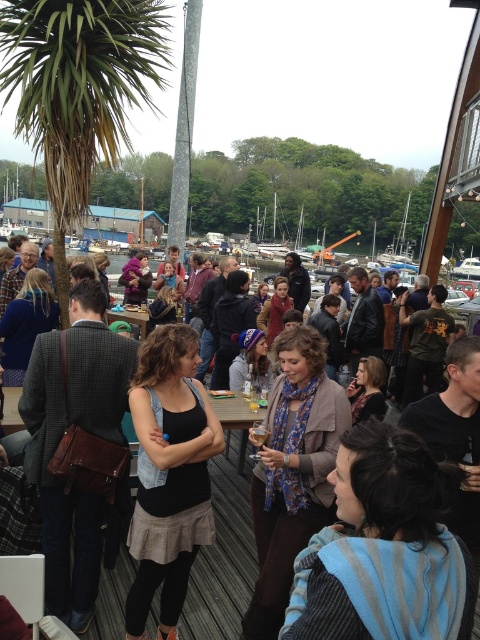
Question: Is the position of black denim tank top at center more distant than that of black leather jacket at center?

Choices:
 (A) yes
 (B) no

Answer: (A)

Question: Which object appears farthest from the camera in this image?

Choices:
 (A) black denim tank top at center
 (B) black leather jacket at center

Answer: (A)

Question: Can you confirm if black denim tank top at center is wider than black leather jacket at center?

Choices:
 (A) yes
 (B) no

Answer: (B)

Question: Does black denim tank top at center have a larger size compared to black leather jacket at center?

Choices:
 (A) yes
 (B) no

Answer: (B)

Question: Which point appears closest to the camera in this image?

Choices:
 (A) (189, 520)
 (B) (204, 593)

Answer: (A)

Question: Which point is closer to the camera?

Choices:
 (A) black leather jacket at center
 (B) black denim tank top at center

Answer: (A)